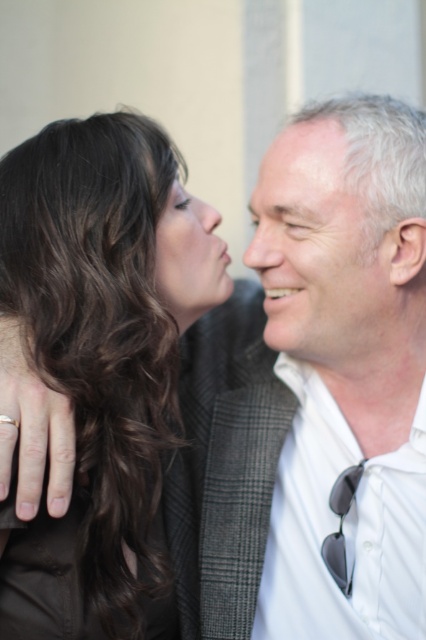
You are an artist sketching this scene and need to place the dark brown hair at left and the matte black hair at upper left accurately. Which of the two hairs is positioned further to the left?

The dark brown hair at left is positioned further to the left compared to the matte black hair at upper left.

You are an artist sketching this scene and need to ensure proportions are accurate. Which of the two hair sections, the dark brown hair at left or the matte black hair at upper left, should you draw taller to maintain the correct proportions?

The dark brown hair at left should be drawn taller since it has a greater height compared to the matte black hair at upper left according to the description.